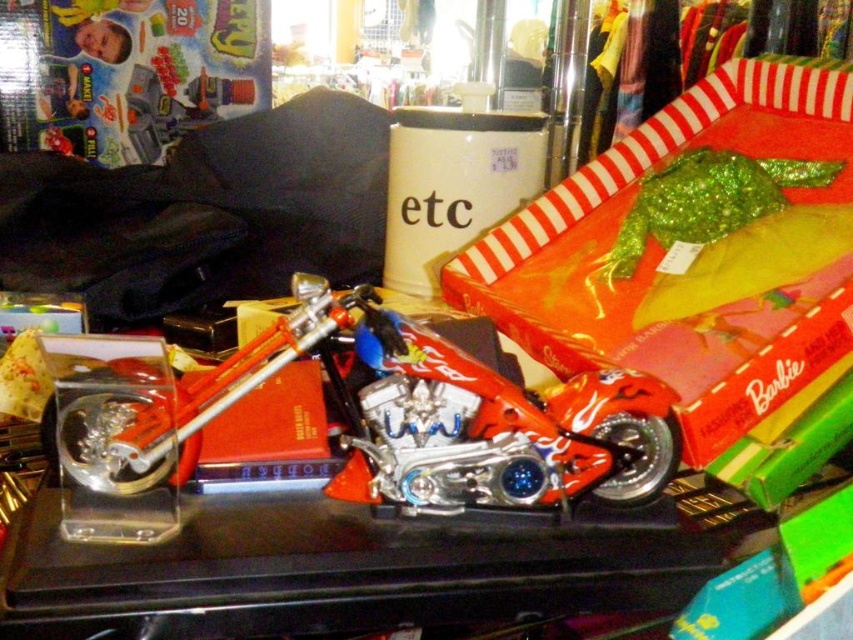
Which is more to the left, shiny metallic motorcycle at center or shiny red motorcycle at center?

shiny metallic motorcycle at center is more to the left.

Does point (300, 278) lie behind point (512, 470)?

Yes, point (300, 278) is behind point (512, 470).

Locate an element on the screen. shiny metallic motorcycle at center is located at coordinates (399, 420).